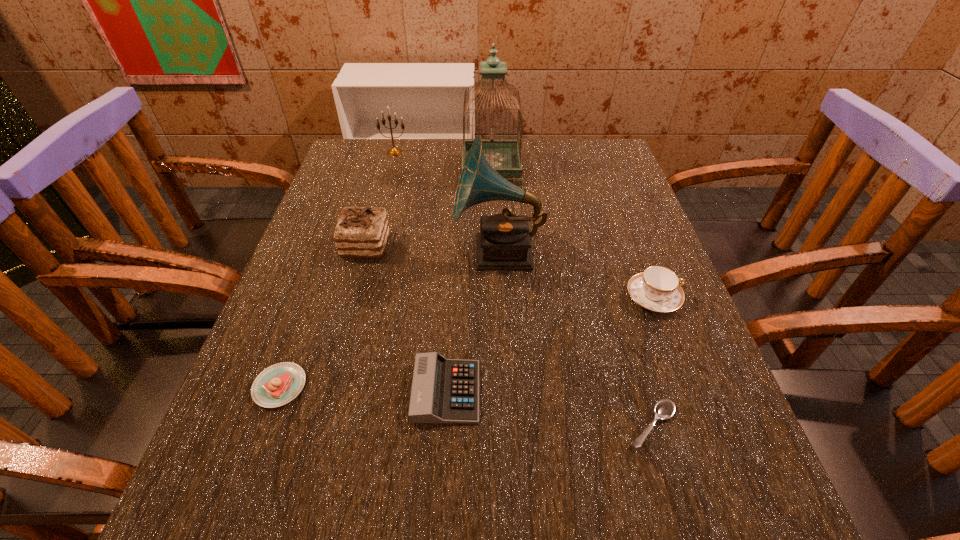
Where is `unoccupied area between the shortest object and the tallest object`? unoccupied area between the shortest object and the tallest object is located at coordinates (572, 297).

Image resolution: width=960 pixels, height=540 pixels. What are the coordinates of `vacant area between the phonograph_record and the fifth tallest object` in the screenshot? It's located at (576, 275).

Where is `empty location between the teacup and the birdcage`? The width and height of the screenshot is (960, 540). empty location between the teacup and the birdcage is located at coordinates (572, 233).

Where is `object that is the fourth closest to the phonograph_record`? object that is the fourth closest to the phonograph_record is located at coordinates (444, 391).

Choose which object is the seventh nearest neighbor to the chocolate cake. Please provide its 2D coordinates. Your answer should be formatted as a tuple, i.e. [(x, y)], where the tuple contains the x and y coordinates of a point satisfying the conditions above.

[(664, 409)]

At what (x,y) coordinates should I click in order to perform the action: click on free space in the image that satisfies the following two spatial constraints: 1. at the door of the tallest object; 2. on the front side of the pastry. Please return your answer as a coordinate pair (x, y). The image size is (960, 540). Looking at the image, I should click on (498, 386).

This screenshot has width=960, height=540. I want to click on vacant space that satisfies the following two spatial constraints: 1. on the back side of the candelabrum; 2. on the right side of the chocolate cake, so click(x=392, y=152).

Where is `free spot that satisfies the following two spatial constraints: 1. at the door of the tallest object; 2. on the front side of the calculator`? Image resolution: width=960 pixels, height=540 pixels. free spot that satisfies the following two spatial constraints: 1. at the door of the tallest object; 2. on the front side of the calculator is located at coordinates (499, 392).